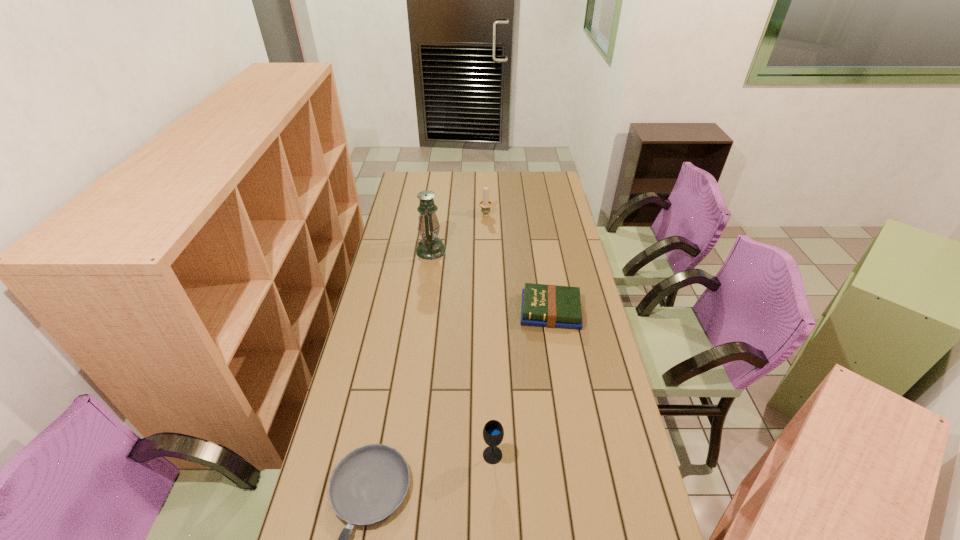
Locate an element on the screen. The height and width of the screenshot is (540, 960). vacant region located 0.250m on the left of the wineglass is located at coordinates (396, 455).

Find the location of `free region located 0.290m on the front of the second shortest object`. free region located 0.290m on the front of the second shortest object is located at coordinates (565, 399).

Find the location of a particular element. The image size is (960, 540). object that is at the left edge is located at coordinates [430, 247].

What are the coordinates of `object located in the right edge section of the desktop` in the screenshot? It's located at (552, 306).

In the image, there is a desktop. At what (x,y) coordinates should I click in order to perform the action: click on blank space at the far edge. Please return your answer as a coordinate pair (x, y). Looking at the image, I should click on [x=467, y=188].

At what (x,y) coordinates should I click in order to perform the action: click on free location at the left edge of the desktop. Please return your answer as a coordinate pair (x, y). This screenshot has width=960, height=540. Looking at the image, I should click on (407, 218).

Find the location of `vacant area at the right edge`. vacant area at the right edge is located at coordinates (578, 285).

What are the coordinates of `free point at the far left corner` in the screenshot? It's located at (417, 187).

The height and width of the screenshot is (540, 960). I want to click on vacant region at the far right corner of the desktop, so click(540, 174).

At what (x,y) coordinates should I click in order to perform the action: click on vacant space in between the wineglass and the fourth tallest object. Please return your answer as a coordinate pair (x, y). The width and height of the screenshot is (960, 540). Looking at the image, I should click on (521, 383).